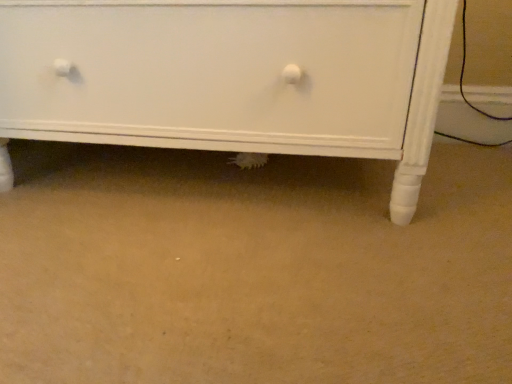
Image resolution: width=512 pixels, height=384 pixels. I want to click on white painted wood chest of drawers at lower center, so click(x=232, y=77).

What do you see at coordinates (232, 77) in the screenshot?
I see `white painted wood chest of drawers at lower center` at bounding box center [232, 77].

Locate an element on the screen. Image resolution: width=512 pixels, height=384 pixels. white painted wood chest of drawers at lower center is located at coordinates (232, 77).